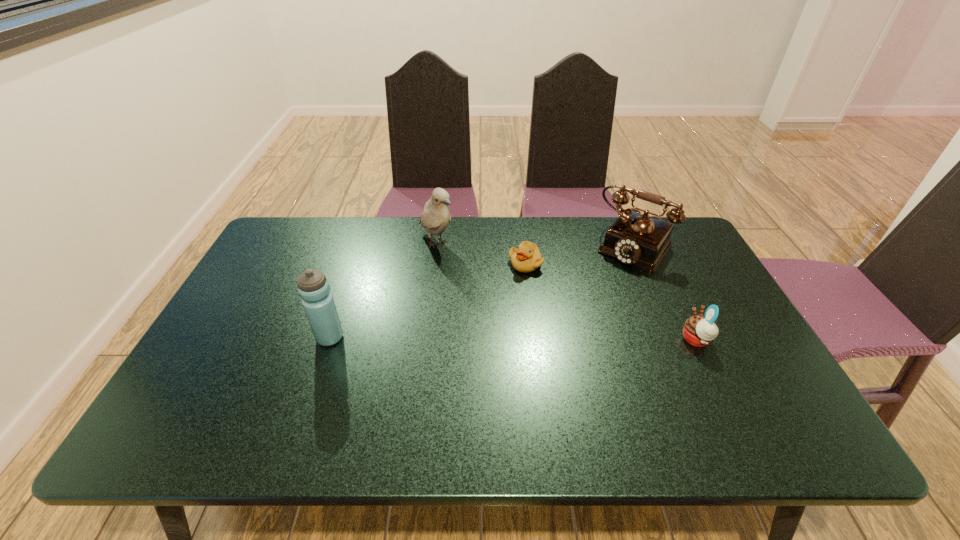
You are a GUI agent. You are given a task and a screenshot of the screen. Output one action in this format:
    pyautogui.click(x=<x>, y=<y>)
    Task: Click on the vacant area at the far right corner
    
    Given the screenshot: What is the action you would take?
    [680, 227]

At what (x,y) coordinates should I click in order to perform the action: click on unoccupied area between the third object from left to right and the water bottle. Please return your answer as a coordinate pair (x, y). Looking at the image, I should click on (427, 301).

I want to click on free space that is in between the telephone and the water bottle, so click(x=482, y=291).

I want to click on free space between the water bottle and the telephone, so click(482, 291).

This screenshot has height=540, width=960. What are the coordinates of `free space that is in between the water bottle and the second shortest object` in the screenshot? It's located at (513, 339).

I want to click on vacant point located between the duckling and the muffin, so click(611, 302).

Find the location of a particular element. The image size is (960, 540). free spot between the telephone and the shortest object is located at coordinates (580, 254).

At what (x,y) coordinates should I click in order to perform the action: click on free space between the fourth tallest object and the duckling. Please return your answer as a coordinate pair (x, y). Looking at the image, I should click on (611, 302).

Identify the location of vacant region between the third object from right to left and the second shortest object. (611, 302).

This screenshot has height=540, width=960. I want to click on unoccupied area between the fourth tallest object and the shortest object, so click(x=611, y=302).